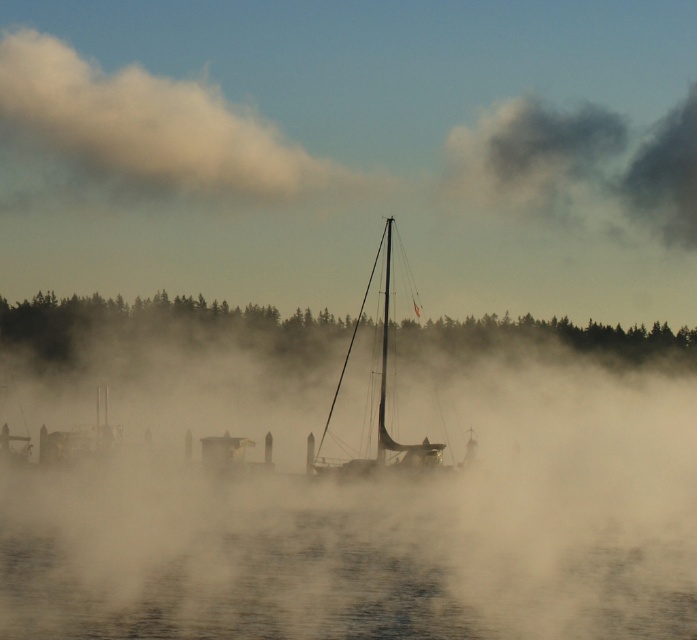
You are an observer standing on the pier. You see the translucent misty water at center and the dark gray fluffy cloud at upper right. Which object is lower in the scene?

The translucent misty water at center is lower than the dark gray fluffy cloud at upper right because it is not as tall as the cloud.